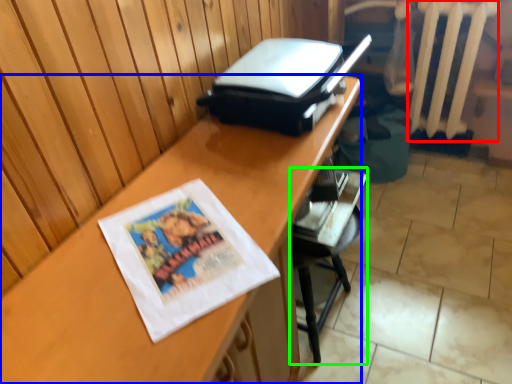
Question: Estimate the real-world distances between objects in this image. Which object is farther from radiator (highlighted by a red box), desk (highlighted by a blue box) or furniture (highlighted by a green box)?

Choices:
 (A) desk
 (B) furniture

Answer: (A)